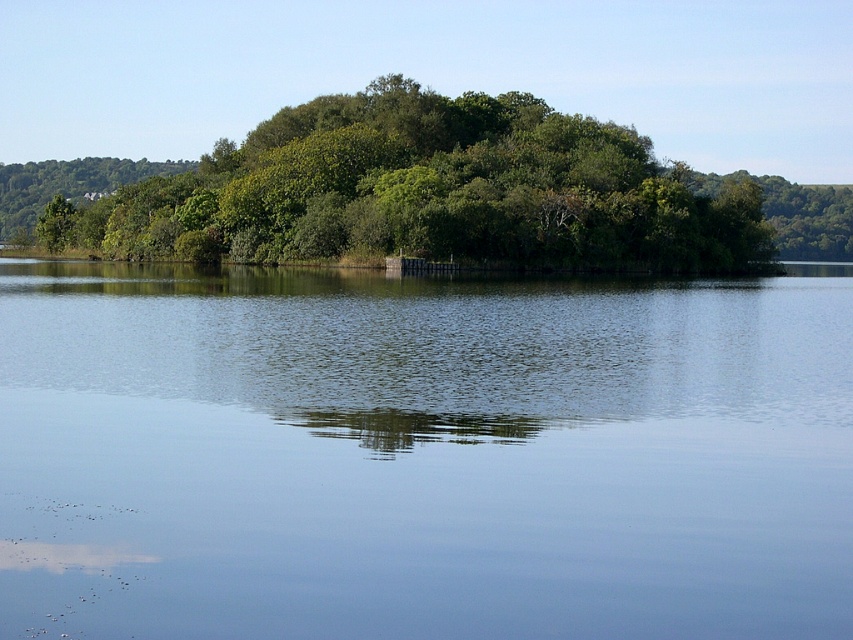
Does transparent water at center lie behind green leafy trees at center?

No, it is in front of green leafy trees at center.

Is transparent water at center smaller than green leafy trees at center?

Yes.

Locate an element on the screen. transparent water at center is located at coordinates (421, 454).

Find the location of a particular element. The image size is (853, 640). transparent water at center is located at coordinates (421, 454).